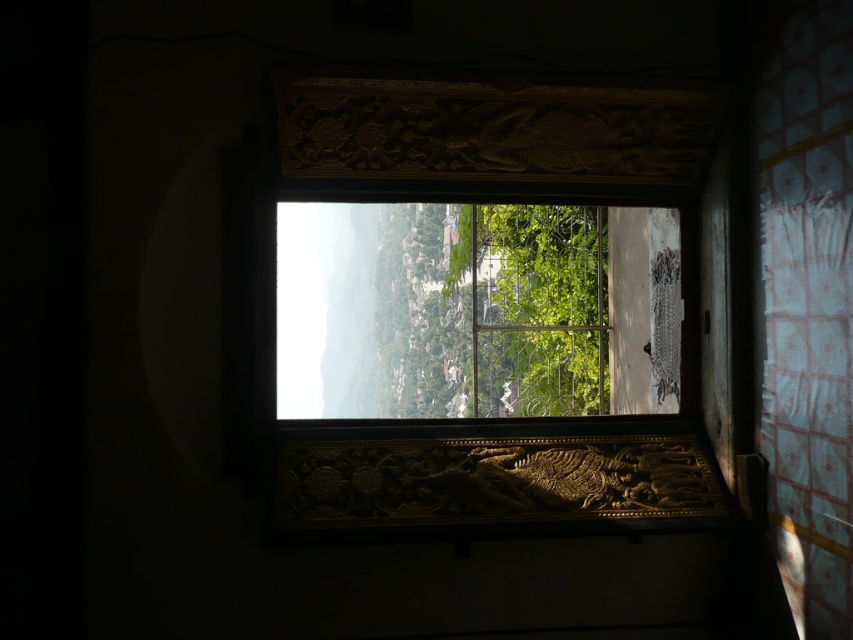
Which is more to the right, gold carved wood at center or green leafy tree at center?

gold carved wood at center

Describe the element at coordinates (492, 481) in the screenshot. I see `gold carved wood at center` at that location.

Does point (294, 486) come behind point (502, 392)?

No, it is not.

The height and width of the screenshot is (640, 853). I want to click on gold carved wood at center, so click(492, 481).